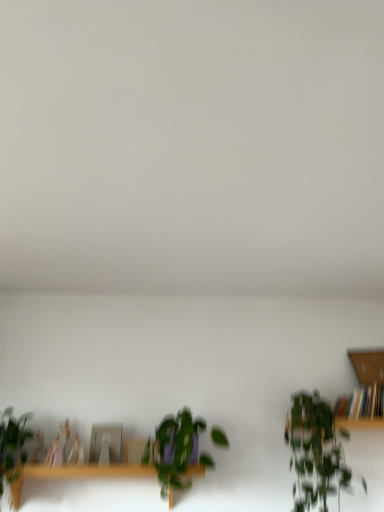
Based on the photo, in order to face wooden bookshelf at right, should I rotate leftwards or rightwards?

Turn right by 22.257 degrees to look at wooden bookshelf at right.

What do you see at coordinates (316, 452) in the screenshot?
I see `green leafy plant at right, marked as the first houseplant in a right-to-left arrangement` at bounding box center [316, 452].

The image size is (384, 512). What do you see at coordinates (175, 450) in the screenshot?
I see `green leafy plant at center, which appears as the 2th houseplant when viewed from the left` at bounding box center [175, 450].

This screenshot has width=384, height=512. I want to click on wooden table at lower center, so click(x=78, y=474).

This screenshot has width=384, height=512. I want to click on wooden bookshelf at right, so click(x=362, y=403).

Is there a large distance between wooden table at lower center and green leafy plant at center, which appears as the 2th houseplant when viewed from the right?

That's not correct — wooden table at lower center is a little close to green leafy plant at center, which appears as the 2th houseplant when viewed from the right.

Is wooden table at lower center aimed at green leafy plant at center, which appears as the 2th houseplant when viewed from the left?

No.

In the scene shown: From the image's perspective, does wooden table at lower center appear lower than green leafy plant at center, which appears as the 2th houseplant when viewed from the left?

Yes, from the image's perspective, wooden table at lower center is beneath green leafy plant at center, which appears as the 2th houseplant when viewed from the left.

Considering the relative positions of green matte plant at lower left, which is the third houseplant from right to left, and green leafy plant at center, which appears as the 2th houseplant when viewed from the left, in the image provided, is green matte plant at lower left, which is the third houseplant from right to left, to the left or to the right of green leafy plant at center, which appears as the 2th houseplant when viewed from the left,?

green matte plant at lower left, which is the third houseplant from right to left, is to the left of green leafy plant at center, which appears as the 2th houseplant when viewed from the left.

Is there a large distance between green matte plant at lower left, which is the third houseplant from right to left, and green leafy plant at center, which appears as the 2th houseplant when viewed from the right?

Actually, green matte plant at lower left, which is the third houseplant from right to left, and green leafy plant at center, which appears as the 2th houseplant when viewed from the right, are a little close together.

What are the coordinates of `the 1st houseplant to the right when counting from the green matte plant at lower left, which ranks as the first houseplant in left-to-right order` in the screenshot? It's located at (175, 450).

From a real-world perspective, between green matte plant at lower left, which is the third houseplant from right to left, and green leafy plant at center, which appears as the 2th houseplant when viewed from the right, who is vertically lower?

green matte plant at lower left, which is the third houseplant from right to left, from a real-world perspective.

From the image's perspective, which object appears higher, wooden bookshelf at right or green leafy plant at right, marked as the first houseplant in a right-to-left arrangement?

wooden bookshelf at right, from the image's perspective.

Identify the location of book that is on the right side of green leafy plant at right, marked as the first houseplant in a right-to-left arrangement. Image resolution: width=384 pixels, height=512 pixels. (362, 403).

Is wooden bookshelf at right beside green leafy plant at right, marked as the first houseplant in a right-to-left arrangement?

wooden bookshelf at right and green leafy plant at right, marked as the first houseplant in a right-to-left arrangement, are clearly separated.

Which is further, (373, 391) or (310, 466)?

Positioned behind is point (373, 391).

Is green leafy plant at right, marked as the first houseplant in a right-to-left arrangement, next to green leafy plant at center, which appears as the 2th houseplant when viewed from the left, and touching it?

green leafy plant at right, marked as the first houseplant in a right-to-left arrangement, and green leafy plant at center, which appears as the 2th houseplant when viewed from the left, are not in contact.

Can you confirm if green leafy plant at right, the third houseplant positioned from the left, is positioned to the right of green leafy plant at center, which appears as the 2th houseplant when viewed from the left?

Indeed, green leafy plant at right, the third houseplant positioned from the left, is positioned on the right side of green leafy plant at center, which appears as the 2th houseplant when viewed from the left.

From the image's perspective, count 1st houseplants upward from the green leafy plant at center, which appears as the 2th houseplant when viewed from the left, and point to it. Please provide its 2D coordinates.

[(316, 452)]

From the image's perspective, is green leafy plant at right, the third houseplant positioned from the left, beneath green leafy plant at center, which appears as the 2th houseplant when viewed from the right?

Incorrect, from the image's perspective, green leafy plant at right, the third houseplant positioned from the left, is higher than green leafy plant at center, which appears as the 2th houseplant when viewed from the right.

From a real-world perspective, does wooden table at lower center sit lower than green matte plant at lower left, which ranks as the first houseplant in left-to-right order?

Indeed, from a real-world perspective, wooden table at lower center is positioned beneath green matte plant at lower left, which ranks as the first houseplant in left-to-right order.

Can you tell me how much wooden table at lower center and green matte plant at lower left, which is the third houseplant from right to left, differ in facing direction?

The facing directions of wooden table at lower center and green matte plant at lower left, which is the third houseplant from right to left, are 8.61e-05 degrees apart.

Based on the photo, is wooden table at lower center looking in the opposite direction of green matte plant at lower left, which is the third houseplant from right to left?

No, wooden table at lower center is not facing the opposite direction of green matte plant at lower left, which is the third houseplant from right to left.

From the image's perspective, does wooden table at lower center appear higher than green matte plant at lower left, which ranks as the first houseplant in left-to-right order?

No, from the image's perspective, wooden table at lower center is not over green matte plant at lower left, which ranks as the first houseplant in left-to-right order.

From a real-world perspective, which object stands above the other?

green leafy plant at right, marked as the first houseplant in a right-to-left arrangement.

How many degrees apart are the facing directions of green leafy plant at right, marked as the first houseplant in a right-to-left arrangement, and green matte plant at lower left, which is the third houseplant from right to left?

The angle between the facing direction of green leafy plant at right, marked as the first houseplant in a right-to-left arrangement, and the facing direction of green matte plant at lower left, which is the third houseplant from right to left, is 6.5e-05 degrees.

Based on the photo, considering the relative sizes of green leafy plant at right, marked as the first houseplant in a right-to-left arrangement, and green matte plant at lower left, which ranks as the first houseplant in left-to-right order, in the image provided, is green leafy plant at right, marked as the first houseplant in a right-to-left arrangement, shorter than green matte plant at lower left, which ranks as the first houseplant in left-to-right order,?

In fact, green leafy plant at right, marked as the first houseplant in a right-to-left arrangement, may be taller than green matte plant at lower left, which ranks as the first houseplant in left-to-right order.

Considering the relative sizes of green leafy plant at center, which appears as the 2th houseplant when viewed from the right, and wooden table at lower center in the image provided, is green leafy plant at center, which appears as the 2th houseplant when viewed from the right, smaller than wooden table at lower center?

Yes, green leafy plant at center, which appears as the 2th houseplant when viewed from the right, is smaller than wooden table at lower center.

From a real-world perspective, is green leafy plant at center, which appears as the 2th houseplant when viewed from the left, located beneath wooden table at lower center?

No.

Which is behind, point (181, 411) or point (33, 476)?

The point (181, 411) is behind.

Measure the distance from green leafy plant at center, which appears as the 2th houseplant when viewed from the left, to wooden table at lower center.

green leafy plant at center, which appears as the 2th houseplant when viewed from the left, is 5.87 inches from wooden table at lower center.

The height and width of the screenshot is (512, 384). I want to click on table behind the green leafy plant at center, which appears as the 2th houseplant when viewed from the left, so click(78, 474).

Which houseplant is the 1st one when counting from the right side of the green matte plant at lower left, which is the third houseplant from right to left? Please provide its 2D coordinates.

[(175, 450)]

From the image, which object appears to be nearer to green leafy plant at right, the third houseplant positioned from the left, wooden bookshelf at right or wooden table at lower center?

wooden bookshelf at right.

Considering their positions, is wooden bookshelf at right positioned further to wooden table at lower center than green leafy plant at center, which appears as the 2th houseplant when viewed from the left?

wooden bookshelf at right lies further to wooden table at lower center than the other object.

When comparing their distances from green leafy plant at right, the third houseplant positioned from the left, does green leafy plant at center, which appears as the 2th houseplant when viewed from the right, or wooden bookshelf at right seem closer?

wooden bookshelf at right is positioned closer to the anchor green leafy plant at right, the third houseplant positioned from the left.

From the image, which object appears to be farther from green leafy plant at right, the third houseplant positioned from the left, green matte plant at lower left, which ranks as the first houseplant in left-to-right order, or wooden table at lower center?

green matte plant at lower left, which ranks as the first houseplant in left-to-right order, is positioned further to the anchor green leafy plant at right, the third houseplant positioned from the left.

Considering their positions, is green leafy plant at right, marked as the first houseplant in a right-to-left arrangement, positioned further to wooden bookshelf at right than green leafy plant at center, which appears as the 2th houseplant when viewed from the right?

green leafy plant at center, which appears as the 2th houseplant when viewed from the right.

Based on their spatial positions, is green leafy plant at center, which appears as the 2th houseplant when viewed from the left, or green leafy plant at right, marked as the first houseplant in a right-to-left arrangement, closer to wooden bookshelf at right?

The object closer to wooden bookshelf at right is green leafy plant at right, marked as the first houseplant in a right-to-left arrangement.

From the image, which object appears to be nearer to wooden table at lower center, green matte plant at lower left, which is the third houseplant from right to left, or wooden bookshelf at right?

Among the two, green matte plant at lower left, which is the third houseplant from right to left, is located nearer to wooden table at lower center.

Looking at the image, which one is located closer to green matte plant at lower left, which is the third houseplant from right to left, green leafy plant at center, which appears as the 2th houseplant when viewed from the right, or green leafy plant at right, marked as the first houseplant in a right-to-left arrangement?

green leafy plant at center, which appears as the 2th houseplant when viewed from the right.

Where is `table located between green matte plant at lower left, which ranks as the first houseplant in left-to-right order, and green leafy plant at right, marked as the first houseplant in a right-to-left arrangement, in the left-right direction`? table located between green matte plant at lower left, which ranks as the first houseplant in left-to-right order, and green leafy plant at right, marked as the first houseplant in a right-to-left arrangement, in the left-right direction is located at coordinates (78, 474).

Where is `table between green matte plant at lower left, which ranks as the first houseplant in left-to-right order, and green leafy plant at center, which appears as the 2th houseplant when viewed from the left`? table between green matte plant at lower left, which ranks as the first houseplant in left-to-right order, and green leafy plant at center, which appears as the 2th houseplant when viewed from the left is located at coordinates (78, 474).

Where is `houseplant between wooden table at lower center and green leafy plant at right, marked as the first houseplant in a right-to-left arrangement`? houseplant between wooden table at lower center and green leafy plant at right, marked as the first houseplant in a right-to-left arrangement is located at coordinates (175, 450).

This screenshot has height=512, width=384. I want to click on table between green matte plant at lower left, which is the third houseplant from right to left, and wooden bookshelf at right, so click(x=78, y=474).